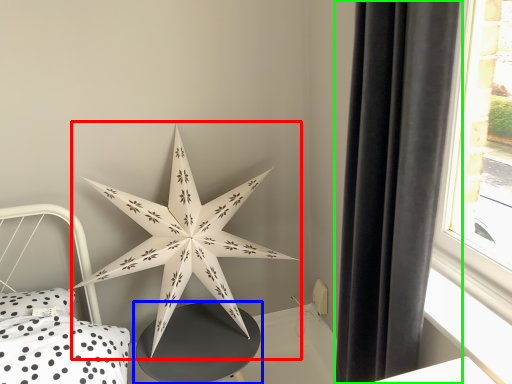
Question: Considering the real-world distances, which object is closest to star (highlighted by a red box)? table (highlighted by a blue box) or curtain (highlighted by a green box).

Choices:
 (A) table
 (B) curtain

Answer: (A)